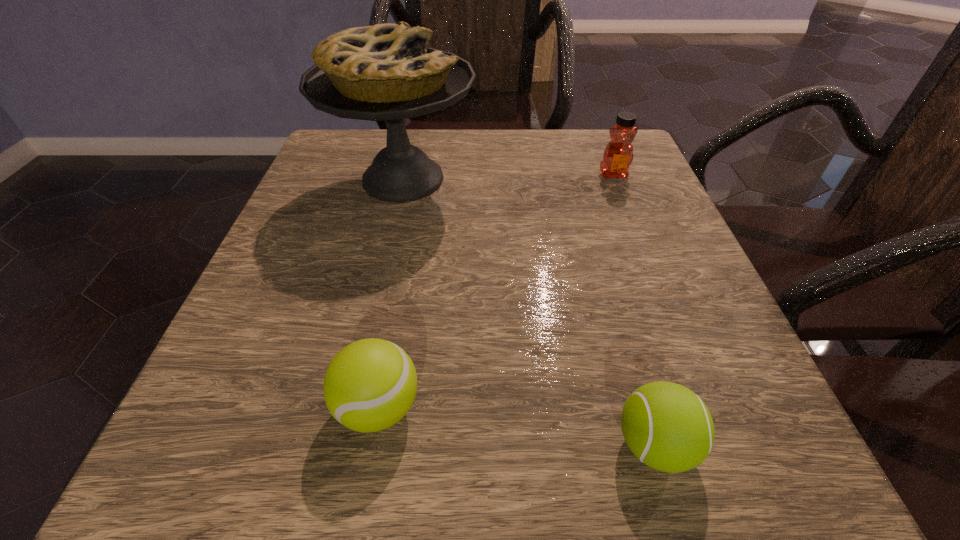
Locate an element on the screen. This screenshot has height=540, width=960. object that is at the left edge is located at coordinates (382, 72).

This screenshot has width=960, height=540. Identify the location of honey at the right edge. (618, 155).

At what (x,y) coordinates should I click in order to perform the action: click on tennis ball situated at the right edge. Please return your answer as a coordinate pair (x, y). This screenshot has width=960, height=540. Looking at the image, I should click on (668, 427).

This screenshot has height=540, width=960. In order to click on object located in the far left corner section of the desktop in this screenshot , I will do `click(382, 72)`.

Where is `object located at the far right corner`? Image resolution: width=960 pixels, height=540 pixels. object located at the far right corner is located at coordinates (618, 155).

Locate an element on the screen. This screenshot has width=960, height=540. object that is at the near right corner is located at coordinates (668, 427).

In the image, there is a desktop. Identify the location of vacant area at the far edge. The image size is (960, 540). (565, 181).

This screenshot has width=960, height=540. Identify the location of free spot at the left edge of the desktop. (366, 227).

In the image, there is a desktop. Identify the location of vacant space at the right edge. This screenshot has width=960, height=540. (712, 292).

What are the coordinates of `vacant space at the near left corner of the desktop` in the screenshot? It's located at (279, 470).